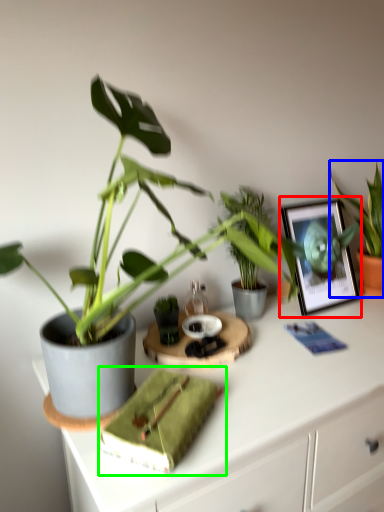
Question: Which is nearer to the picture frame (highlighted by a red box)? houseplant (highlighted by a blue box) or book (highlighted by a green box).

Choices:
 (A) houseplant
 (B) book

Answer: (A)